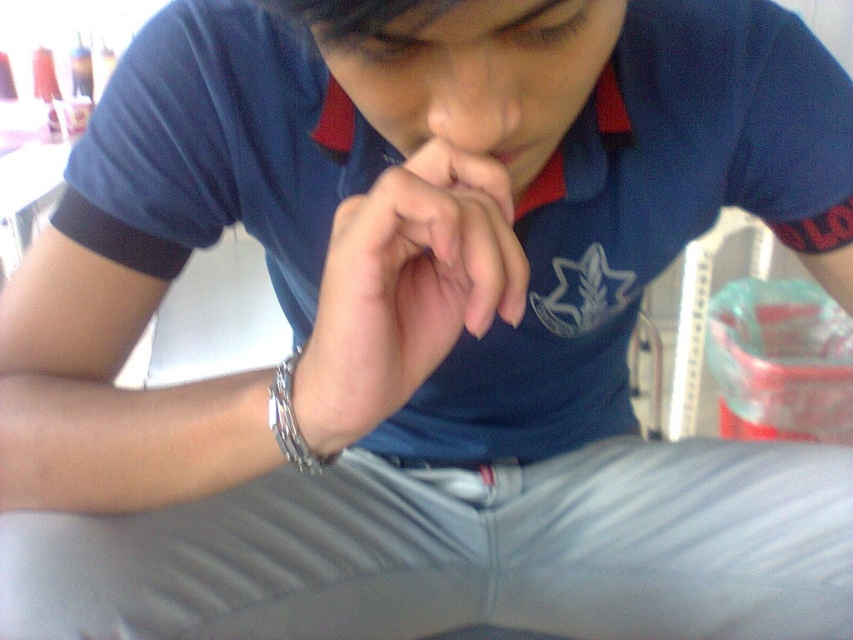
You are a personal assistant trying to discreetly hand a small note to the person in the image. The note is in your hand and you need to place it between their smooth skin hands at center and silver metallic bracelet at lower center. Can you fit the note there without it overlapping either object?

The distance between the smooth skin hands at center and the silver metallic bracelet at lower center is 6.68 centimeters. Since the note is small, it should fit in the space between them without overlapping either object.

You are a fashion designer observing the person in the image. You need to decide whether the silver metallic bracelet at lower center will be visible when the smooth skin hands at center are raised. Based on their positions, what do you think?

The smooth skin hands at center is much taller than the silver metallic bracelet at lower center, so when the hands are raised, the bracelet will still be visible as it is positioned lower and closer to the wrist area.

You are standing in the room and want to reach the point at coordinates (413, 280). Your arm can extend 16 inches. Can you reach it?

The point at coordinates (413, 280) is 16.85 inches from the viewer, so your arm can not reach it since it extends only 16 inches.